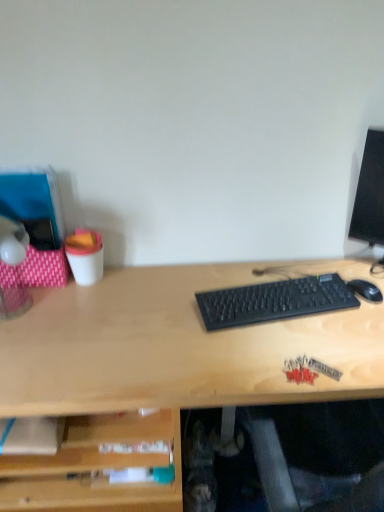
Question: Is translucent plastic lamp at left in front of or behind black plastic keyboard at center in the image?

Choices:
 (A) front
 (B) behind

Answer: (A)

Question: Is translucent plastic lamp at left situated inside black plastic keyboard at center or outside?

Choices:
 (A) inside
 (B) outside

Answer: (B)

Question: Considering the real-world distances, which object is closest to the translucent plastic lamp at left?

Choices:
 (A) black matte mouse at right
 (B) black plastic keyboard at center

Answer: (B)

Question: Estimate the real-world distances between objects in this image. Which object is farther from the translucent plastic lamp at left?

Choices:
 (A) black matte mouse at right
 (B) black plastic keyboard at center

Answer: (A)